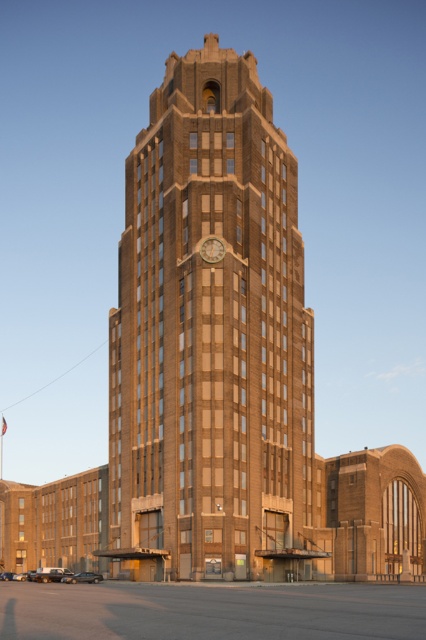
From the picture: You are standing in front of the historic building and want to take a photo that includes both the point at coordinates point (x=111, y=369) and point (x=207, y=248). Which point will appear closer to the front of the photo?

Point (x=111, y=369) is further to the camera than point (x=207, y=248), so it will appear closer to the front of the photo.

You are standing in front of the building and want to take a photo that includes the brown brick tower at center. Based on its position, where should you aim your camera to ensure the tower is centered in the frame?

Since the brown brick tower at center is located at coordinates approximately 0.533 on the x and 0.498 on the y axis, you should aim your camera slightly to the right and just below the center point to capture the tower in the frame.